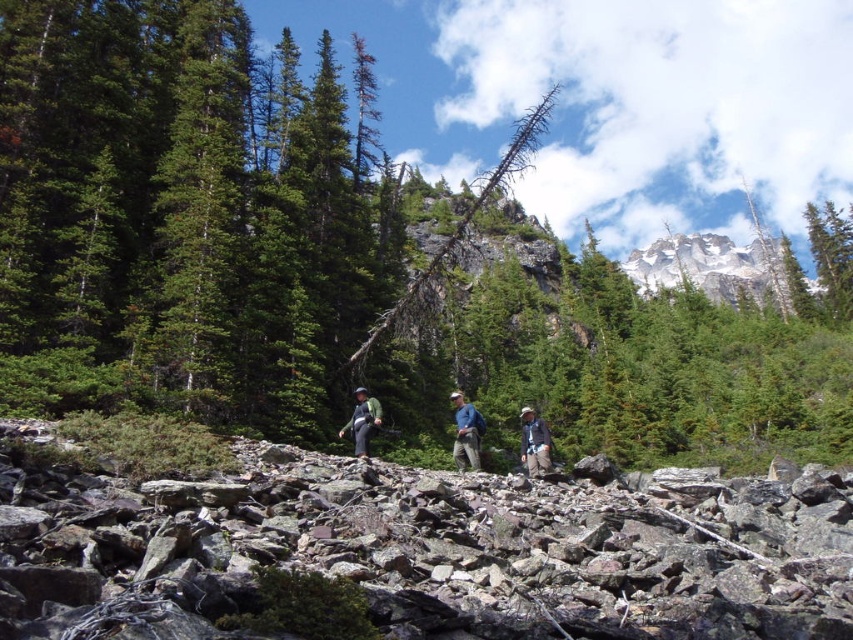
You are a hiker navigating the rocky terrain and see the green textured tree at center and the khaki pants at center. Which object is located to the right of the other?

The green textured tree at center is positioned on the right side of khaki pants at center, so the tree is to the right of the khaki pants.

You are a hiker trying to navigate through the rocky terrain. You notice the green textured tree at center and the khaki pants at center. Which object would block your path more if you were to walk straight ahead?

The green textured tree at center would block your path more than the khaki pants at center since it is bigger in size.

Looking at this image, you are a hiker planning to reach the green textured tree at center from your current position near the green fabric backpack at center. Given that your average hiking pace is 5 km per hour, approximately how long will it take you to reach the tree?

The distance between the green textured tree at center and the green fabric backpack at center is 262.21 meters. At a pace of 5 km per hour, which is 5000 meters per hour, you would take approximately 262.21 divided by 5000 multiplied by 60 minutes, resulting in roughly 3.14652 minutes, so about 3 minutes and 8 seconds to reach the tree.